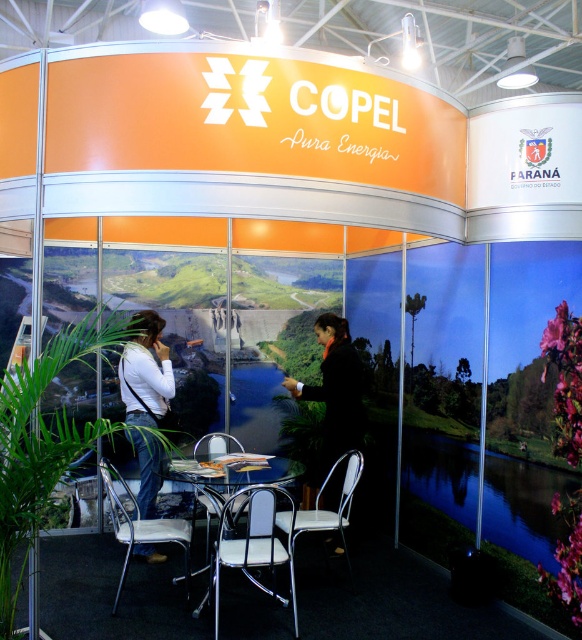
Who is higher up, chrome/chrome chair at center or metallic silver chair at center?

Positioned higher is metallic silver chair at center.

Is chrome/chrome chair at center taller than metallic silver chair at center?

Indeed, chrome/chrome chair at center has a greater height compared to metallic silver chair at center.

Between point (260, 512) and point (215, 461), which one is positioned in front?

Point (260, 512) is more forward.

The width and height of the screenshot is (582, 640). What are the coordinates of `chrome/chrome chair at center` in the screenshot? It's located at (253, 541).

Can you confirm if white matte shirt at center is wider than metallic silver chair at center?

In fact, white matte shirt at center might be narrower than metallic silver chair at center.

You are a GUI agent. You are given a task and a screenshot of the screen. Output one action in this format:
    pyautogui.click(x=<x>, y=<y>)
    Task: Click on the white matte shirt at center
    Image resolution: width=582 pixels, height=640 pixels.
    Given the screenshot: What is the action you would take?
    pyautogui.click(x=146, y=371)

Does black fabric coat at center have a larger size compared to chrome/chrome chair at center?

Indeed, black fabric coat at center has a larger size compared to chrome/chrome chair at center.

Is point (328, 465) positioned after point (232, 529)?

Yes.

You are a GUI agent. You are given a task and a screenshot of the screen. Output one action in this format:
    pyautogui.click(x=<x>, y=<y>)
    Task: Click on the black fabric coat at center
    The width and height of the screenshot is (582, 640).
    Given the screenshot: What is the action you would take?
    pyautogui.click(x=333, y=396)

Identify the location of black fabric coat at center. (333, 396).